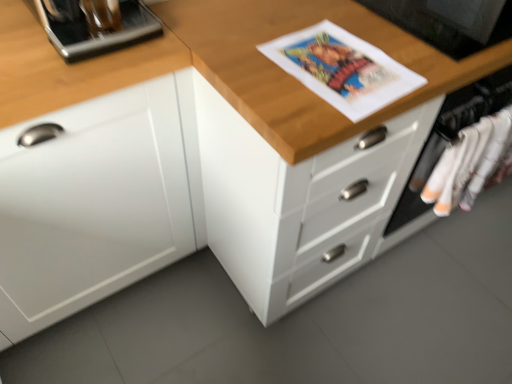
Identify the location of wooden chest of drawers at center. This screenshot has width=512, height=384. (298, 201).

The image size is (512, 384). What do you see at coordinates (96, 31) in the screenshot? I see `metallic silver coffee machine at upper left, which ranks as the second appliance in right-to-left order` at bounding box center [96, 31].

Locate an element on the screen. This screenshot has width=512, height=384. metallic silver coffee machine at upper left, placed as the first appliance when sorted from left to right is located at coordinates (96, 31).

The height and width of the screenshot is (384, 512). I want to click on white matte cabinet at left, so click(x=86, y=174).

Where is `black glossy monitor at upper right, marked as the first appliance in a right-to-left arrangement`? Image resolution: width=512 pixels, height=384 pixels. black glossy monitor at upper right, marked as the first appliance in a right-to-left arrangement is located at coordinates (450, 22).

Is white cotton socks at right behind wooden chest of drawers at center?

Yes, white cotton socks at right is further from the viewer.

Are white cotton socks at right and wooden chest of drawers at center beside each other?

No, white cotton socks at right is not making contact with wooden chest of drawers at center.

Is white cotton socks at right turned away from wooden chest of drawers at center?

Absolutely, white cotton socks at right is directed away from wooden chest of drawers at center.

I want to click on chest of drawers below the white cotton socks at right (from a real-world perspective), so click(298, 201).

Between wooden chest of drawers at center and black glossy monitor at upper right, marked as the first appliance in a right-to-left arrangement, which one appears on the left side from the viewer's perspective?

From the viewer's perspective, black glossy monitor at upper right, marked as the first appliance in a right-to-left arrangement, appears more on the left side.

From the image's perspective, would you say wooden chest of drawers at center is positioned over black glossy monitor at upper right, acting as the second appliance starting from the left?

No, from the image's perspective, wooden chest of drawers at center is not above black glossy monitor at upper right, acting as the second appliance starting from the left.

The height and width of the screenshot is (384, 512). I want to click on chest of drawers in front of the black glossy monitor at upper right, acting as the second appliance starting from the left, so click(298, 201).

Is wooden chest of drawers at center outside of black glossy monitor at upper right, marked as the first appliance in a right-to-left arrangement?

Yes.

Is white matte cabinet at left positioned in front of white cotton socks at right?

Answer: Yes, it is.

Who is bigger, white matte cabinet at left or white cotton socks at right?

Bigger between the two is white matte cabinet at left.

In the image, is white matte cabinet at left on the left side or the right side of white cotton socks at right?

In the image, white matte cabinet at left appears on the left side of white cotton socks at right.

Identify the location of clothing above the white matte cabinet at left (from the image's perspective). (471, 164).

Is metallic silver coffee machine at upper left, placed as the first appliance when sorted from left to right, taller than white matte cabinet at left?

No.

Consider the image. Would you consider metallic silver coffee machine at upper left, placed as the first appliance when sorted from left to right, to be distant from white matte cabinet at left?

metallic silver coffee machine at upper left, placed as the first appliance when sorted from left to right, is near white matte cabinet at left, not far away.

Can you tell me how much metallic silver coffee machine at upper left, which ranks as the second appliance in right-to-left order, and white matte cabinet at left differ in facing direction?

metallic silver coffee machine at upper left, which ranks as the second appliance in right-to-left order, and white matte cabinet at left are facing 0.000557 degrees away from each other.

From a real-world perspective, relative to white matte cabinet at left, is metallic silver coffee machine at upper left, which ranks as the second appliance in right-to-left order, vertically above or below?

metallic silver coffee machine at upper left, which ranks as the second appliance in right-to-left order, is above white matte cabinet at left.

Looking at this image, is there a large distance between white cotton socks at right and white matte cabinet at left?

No, white cotton socks at right is not far from white matte cabinet at left.

Can you confirm if white cotton socks at right is thinner than white matte cabinet at left?

Correct, the width of white cotton socks at right is less than that of white matte cabinet at left.

In terms of size, does white cotton socks at right appear bigger or smaller than white matte cabinet at left?

Clearly, white cotton socks at right is smaller in size than white matte cabinet at left.

In the scene shown: Could you tell me if wooden chest of drawers at center is turned towards white cotton socks at right?

Yes, wooden chest of drawers at center is oriented towards white cotton socks at right.

At what (x,y) coordinates should I click in order to perform the action: click on chest of drawers on the left of white cotton socks at right. Please return your answer as a coordinate pair (x, y). Image resolution: width=512 pixels, height=384 pixels. Looking at the image, I should click on (298, 201).

Is wooden chest of drawers at center beside white cotton socks at right?

No, wooden chest of drawers at center is not making contact with white cotton socks at right.

Does point (300, 195) lie behind point (455, 201)?

No, it is in front of (455, 201).

Looking at this image, from the image's perspective, who appears lower, black glossy monitor at upper right, acting as the second appliance starting from the left, or wooden chest of drawers at center?

From the image's view, wooden chest of drawers at center is below.

You are a GUI agent. You are given a task and a screenshot of the screen. Output one action in this format:
    pyautogui.click(x=<x>, y=<y>)
    Task: Click on the 1st appliance located above the wooden chest of drawers at center (from a real-world perspective)
    
    Given the screenshot: What is the action you would take?
    pyautogui.click(x=450, y=22)

Consider the image. Does black glossy monitor at upper right, acting as the second appliance starting from the left, turn towards wooden chest of drawers at center?

Yes, black glossy monitor at upper right, acting as the second appliance starting from the left, faces towards wooden chest of drawers at center.

Is black glossy monitor at upper right, marked as the first appliance in a right-to-left arrangement, wider or thinner than wooden chest of drawers at center?

black glossy monitor at upper right, marked as the first appliance in a right-to-left arrangement, is thinner than wooden chest of drawers at center.

Where is `chest of drawers to the left of white cotton socks at right`? The image size is (512, 384). chest of drawers to the left of white cotton socks at right is located at coordinates (298, 201).

This screenshot has width=512, height=384. Identify the location of appliance that is the 2nd object located behind the wooden chest of drawers at center. (450, 22).

From the image, which object appears to be nearer to white matte cabinet at left, white cotton socks at right or wooden chest of drawers at center?

wooden chest of drawers at center.

From the picture: Which object lies nearer to the anchor point wooden chest of drawers at center, white matte cabinet at left or white cotton socks at right?

The object closer to wooden chest of drawers at center is white matte cabinet at left.

Estimate the real-world distances between objects in this image. Which object is further from metallic silver coffee machine at upper left, placed as the first appliance when sorted from left to right, white cotton socks at right or wooden chest of drawers at center?

white cotton socks at right is positioned further to the anchor metallic silver coffee machine at upper left, placed as the first appliance when sorted from left to right.

Based on their spatial positions, is metallic silver coffee machine at upper left, placed as the first appliance when sorted from left to right, or white cotton socks at right closer to wooden chest of drawers at center?

The object closer to wooden chest of drawers at center is white cotton socks at right.

When comparing their distances from wooden chest of drawers at center, does black glossy monitor at upper right, marked as the first appliance in a right-to-left arrangement, or metallic silver coffee machine at upper left, placed as the first appliance when sorted from left to right, seem further?

metallic silver coffee machine at upper left, placed as the first appliance when sorted from left to right, is positioned further to the anchor wooden chest of drawers at center.

From the image, which object appears to be nearer to white matte cabinet at left, black glossy monitor at upper right, marked as the first appliance in a right-to-left arrangement, or metallic silver coffee machine at upper left, placed as the first appliance when sorted from left to right?

The object closer to white matte cabinet at left is metallic silver coffee machine at upper left, placed as the first appliance when sorted from left to right.

Which object lies nearer to the anchor point white matte cabinet at left, black glossy monitor at upper right, acting as the second appliance starting from the left, or white cotton socks at right?

black glossy monitor at upper right, acting as the second appliance starting from the left, lies closer to white matte cabinet at left than the other object.

Which object lies nearer to the anchor point wooden chest of drawers at center, white matte cabinet at left or metallic silver coffee machine at upper left, which ranks as the second appliance in right-to-left order?

Among the two, white matte cabinet at left is located nearer to wooden chest of drawers at center.

Image resolution: width=512 pixels, height=384 pixels. I want to click on chest of drawers between metallic silver coffee machine at upper left, placed as the first appliance when sorted from left to right, and white cotton socks at right, in the horizontal direction, so click(x=298, y=201).

Image resolution: width=512 pixels, height=384 pixels. In order to click on appliance situated between white matte cabinet at left and black glossy monitor at upper right, marked as the first appliance in a right-to-left arrangement, from left to right in this screenshot , I will do `click(96, 31)`.

Where is `chest of drawers between black glossy monitor at upper right, acting as the second appliance starting from the left, and white cotton socks at right from top to bottom`? This screenshot has height=384, width=512. chest of drawers between black glossy monitor at upper right, acting as the second appliance starting from the left, and white cotton socks at right from top to bottom is located at coordinates (298, 201).

You are a GUI agent. You are given a task and a screenshot of the screen. Output one action in this format:
    pyautogui.click(x=<x>, y=<y>)
    Task: Click on the appliance situated between metallic silver coffee machine at upper left, which ranks as the second appliance in right-to-left order, and white cotton socks at right from left to right
    
    Given the screenshot: What is the action you would take?
    pyautogui.click(x=450, y=22)